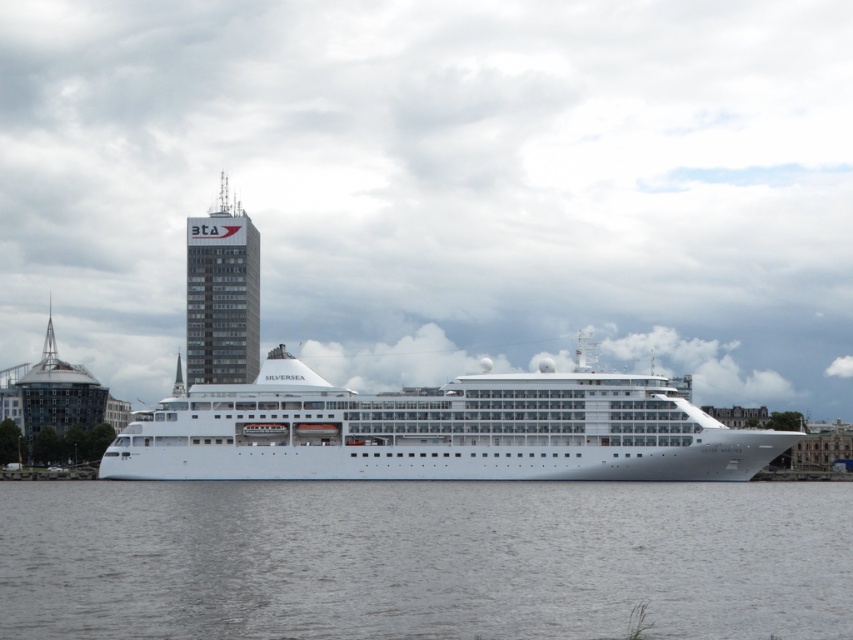
Is gray water at center bigger than white glossy cruise ship at center?

Actually, gray water at center might be smaller than white glossy cruise ship at center.

Is gray water at center to the left of white glossy cruise ship at center from the viewer's perspective?

In fact, gray water at center is to the right of white glossy cruise ship at center.

Who is more distant from viewer, [454,561] or [152,429]?

The point [152,429] is more distant.

Locate an element on the screen. gray water at center is located at coordinates (422, 560).